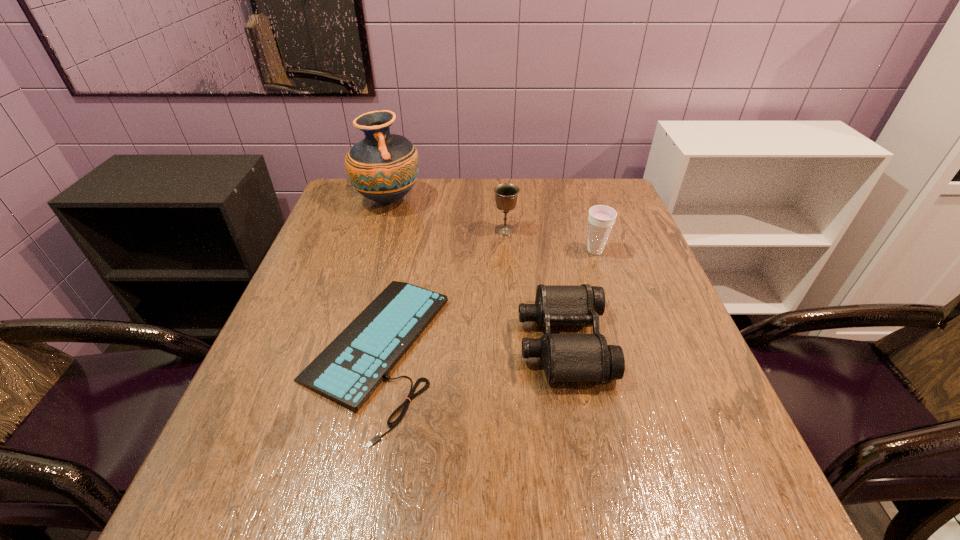
Image resolution: width=960 pixels, height=540 pixels. What are the coordinates of `pottery` in the screenshot? It's located at (383, 167).

Image resolution: width=960 pixels, height=540 pixels. What are the coordinates of `the farthest object` in the screenshot? It's located at (383, 167).

Identify the location of chalice. Image resolution: width=960 pixels, height=540 pixels. (506, 194).

Image resolution: width=960 pixels, height=540 pixels. I want to click on the third farthest object, so click(x=601, y=219).

What are the coordinates of `cup` in the screenshot? It's located at (601, 219).

Image resolution: width=960 pixels, height=540 pixels. I want to click on the fourth tallest object, so click(x=565, y=357).

Where is `computer keyboard`? This screenshot has height=540, width=960. computer keyboard is located at coordinates (351, 367).

Find the location of a particular element. free location located on the right of the pottery is located at coordinates (465, 200).

Identify the location of vacant space located on the right of the fourth nearest object. This screenshot has width=960, height=540. [x=604, y=230].

At what (x,y) coordinates should I click in order to perform the action: click on vacant space located 0.160m on the front of the cup. Please return your answer as a coordinate pair (x, y). The image size is (960, 540). Looking at the image, I should click on (612, 303).